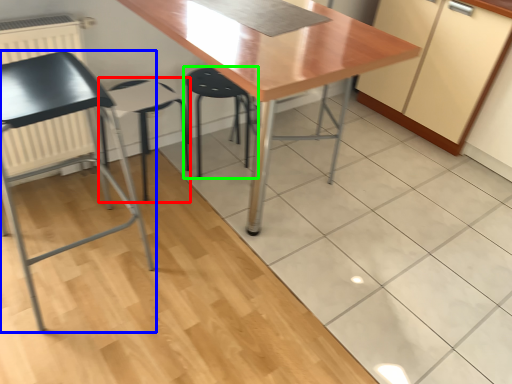
Question: Estimate the real-world distances between objects in this image. Which object is farther from folding chair (highlighted by a red box), chair (highlighted by a blue box) or step stool (highlighted by a green box)?

Choices:
 (A) chair
 (B) step stool

Answer: (B)